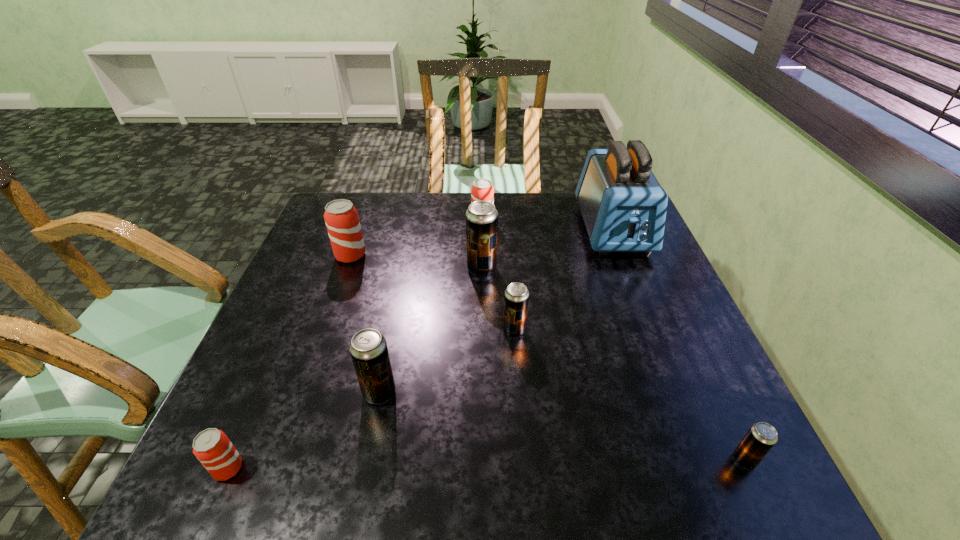
The width and height of the screenshot is (960, 540). What are the coordinates of `vacant area that lies between the smallest black beer can and the blue toaster` in the screenshot? It's located at (679, 344).

At what (x,y) coordinates should I click in order to perform the action: click on vacant region between the smallest black beer can and the third beer can from left to right. Please return your answer as a coordinate pair (x, y). This screenshot has width=960, height=540. Looking at the image, I should click on (562, 426).

Where is `empty space that is in between the smallest black beer can and the third black beer can from left to right`? Image resolution: width=960 pixels, height=540 pixels. empty space that is in between the smallest black beer can and the third black beer can from left to right is located at coordinates (630, 395).

Where is `free space between the second beer can from left to right and the leftmost orange beer can`? This screenshot has height=540, width=960. free space between the second beer can from left to right and the leftmost orange beer can is located at coordinates (289, 362).

Identify which object is the fifth closest to the second black beer can from left to right. Please provide its 2D coordinates. Your answer should be formatted as a tuple, i.e. [(x, y)], where the tuple contains the x and y coordinates of a point satisfying the conditions above.

[(368, 348)]

Point out which object is positioned as the third nearest to the biggest black beer can. Please provide its 2D coordinates. Your answer should be formatted as a tuple, i.e. [(x, y)], where the tuple contains the x and y coordinates of a point satisfying the conditions above.

[(623, 205)]

In order to click on beer can that can be found as the second closest to the sixth object from left to right in this screenshot , I will do `click(368, 348)`.

Locate which beer can is the fifth closest to the sixth beer can from right to left. Please provide its 2D coordinates. Your answer should be formatted as a tuple, i.e. [(x, y)], where the tuple contains the x and y coordinates of a point satisfying the conditions above.

[(212, 447)]

Point out which black beer can is positioned as the nearest to the fourth farthest beer can. Please provide its 2D coordinates. Your answer should be formatted as a tuple, i.e. [(x, y)], where the tuple contains the x and y coordinates of a point satisfying the conditions above.

[(481, 218)]

Select which black beer can appears as the closest to the smallest black beer can. Please provide its 2D coordinates. Your answer should be formatted as a tuple, i.e. [(x, y)], where the tuple contains the x and y coordinates of a point satisfying the conditions above.

[(516, 297)]